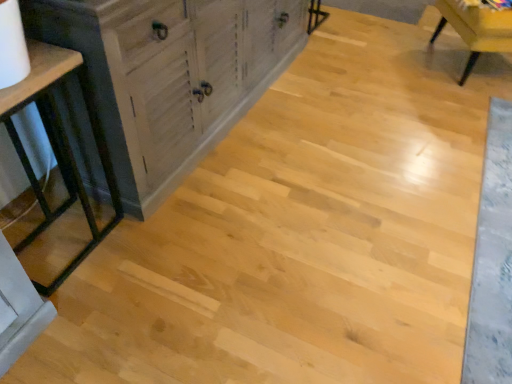
Question: Is wooden chair at upper right smaller than matte black table at left?

Choices:
 (A) no
 (B) yes

Answer: (A)

Question: Considering the relative positions of wooden chair at upper right and matte black table at left in the image provided, is wooden chair at upper right in front of matte black table at left?

Choices:
 (A) no
 (B) yes

Answer: (A)

Question: Considering the relative positions of wooden chair at upper right and matte black table at left in the image provided, is wooden chair at upper right to the right of matte black table at left from the viewer's perspective?

Choices:
 (A) no
 (B) yes

Answer: (B)

Question: Is wooden chair at upper right facing towards matte black table at left?

Choices:
 (A) yes
 (B) no

Answer: (B)

Question: Is wooden chair at upper right not near matte black table at left?

Choices:
 (A) yes
 (B) no

Answer: (A)

Question: From the image's perspective, is matte black table at left above or below distressed wood cabinet at left?

Choices:
 (A) above
 (B) below

Answer: (B)

Question: Visually, is matte black table at left positioned to the left or to the right of distressed wood cabinet at left?

Choices:
 (A) left
 (B) right

Answer: (A)

Question: Is point (57, 59) positioned closer to the camera than point (151, 124)?

Choices:
 (A) closer
 (B) farther

Answer: (A)

Question: Is matte black table at left taller or shorter than distressed wood cabinet at left?

Choices:
 (A) tall
 (B) short

Answer: (B)

Question: In the image, is matte black table at left on the left side or the right side of wooden chair at upper right?

Choices:
 (A) left
 (B) right

Answer: (A)

Question: From their relative heights in the image, would you say matte black table at left is taller or shorter than wooden chair at upper right?

Choices:
 (A) tall
 (B) short

Answer: (A)

Question: Would you say matte black table at left is inside or outside wooden chair at upper right?

Choices:
 (A) outside
 (B) inside

Answer: (A)

Question: From a real-world perspective, relative to wooden chair at upper right, is matte black table at left vertically above or below?

Choices:
 (A) above
 (B) below

Answer: (A)

Question: In terms of size, does wooden chair at upper right appear bigger or smaller than distressed wood cabinet at left?

Choices:
 (A) small
 (B) big

Answer: (A)

Question: Considering the positions of wooden chair at upper right and distressed wood cabinet at left in the image, is wooden chair at upper right wider or thinner than distressed wood cabinet at left?

Choices:
 (A) thin
 (B) wide

Answer: (B)